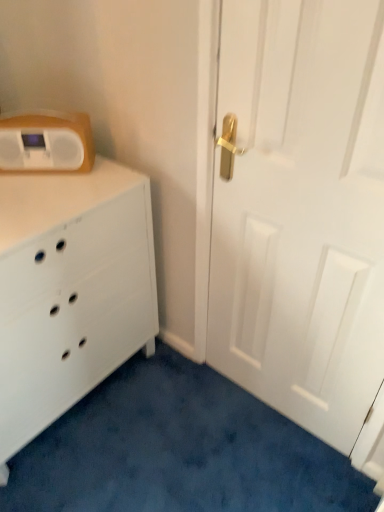
Question: Is point (74, 278) positioned closer to the camera than point (72, 141)?

Choices:
 (A) closer
 (B) farther

Answer: (A)

Question: From the image's perspective, is white matte chest of drawers at left located above or below matte white radio at upper left?

Choices:
 (A) above
 (B) below

Answer: (B)

Question: Which of these objects is positioned farthest from the white matte door at right?

Choices:
 (A) white matte chest of drawers at left
 (B) matte white radio at upper left

Answer: (B)

Question: Which is farther from the white matte door at right?

Choices:
 (A) white matte chest of drawers at left
 (B) matte white radio at upper left

Answer: (B)